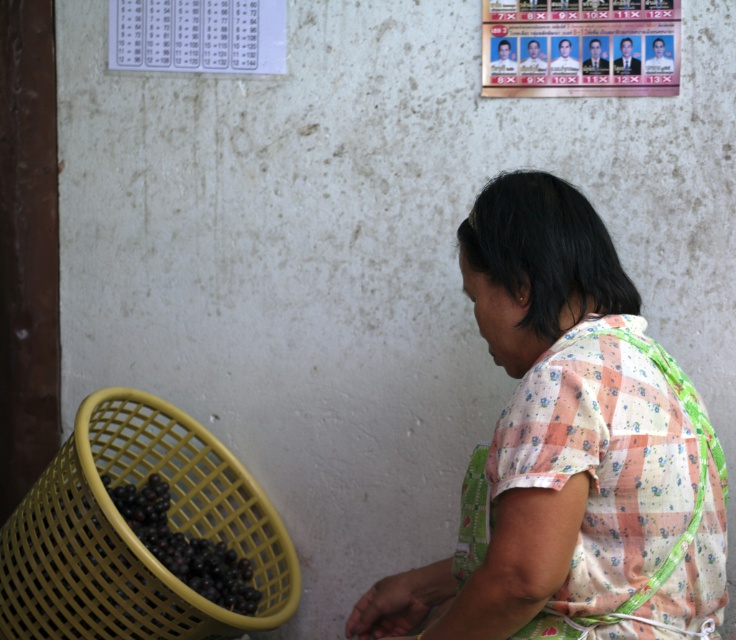
Is white checkered shirt at center to the right of yellow plastic basket at lower left from the viewer's perspective?

Yes, white checkered shirt at center is to the right of yellow plastic basket at lower left.

Can you confirm if white checkered shirt at center is bigger than yellow plastic basket at lower left?

Yes, white checkered shirt at center is bigger than yellow plastic basket at lower left.

Is point (682, 476) in front of point (208, 484)?

Yes, point (682, 476) is closer to viewer.

Identify the location of white checkered shirt at center. Image resolution: width=736 pixels, height=640 pixels. (567, 451).

Can you confirm if yellow plastic basket at lower left is shorter than shiny purple grapes at lower left?

Incorrect, yellow plastic basket at lower left's height does not fall short of shiny purple grapes at lower left's.

Which is in front, point (110, 550) or point (222, 547)?

Point (110, 550) is more forward.

You are a GUI agent. You are given a task and a screenshot of the screen. Output one action in this format:
    pyautogui.click(x=<x>, y=<y>)
    Task: Click on the yellow plastic basket at lower left
    The image size is (736, 640).
    Given the screenshot: What is the action you would take?
    pyautogui.click(x=132, y=532)

Is point (569, 372) in front of point (202, 547)?

Yes, it is.

How much distance is there between white checkered shirt at center and shiny purple grapes at lower left?

white checkered shirt at center is 33.77 inches from shiny purple grapes at lower left.

Describe the element at coordinates (567, 451) in the screenshot. This screenshot has width=736, height=640. I see `white checkered shirt at center` at that location.

Find the location of a particular element. The width and height of the screenshot is (736, 640). white checkered shirt at center is located at coordinates (567, 451).